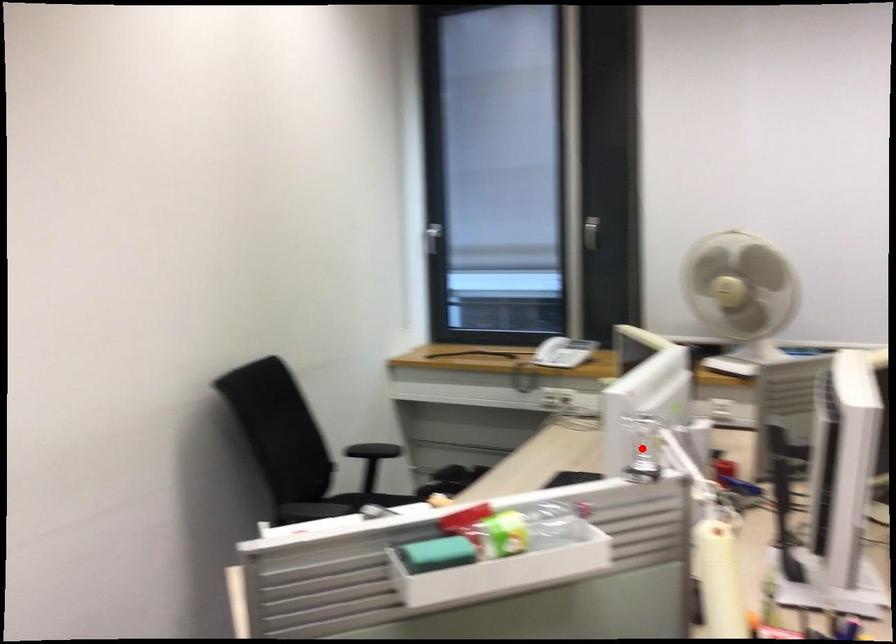
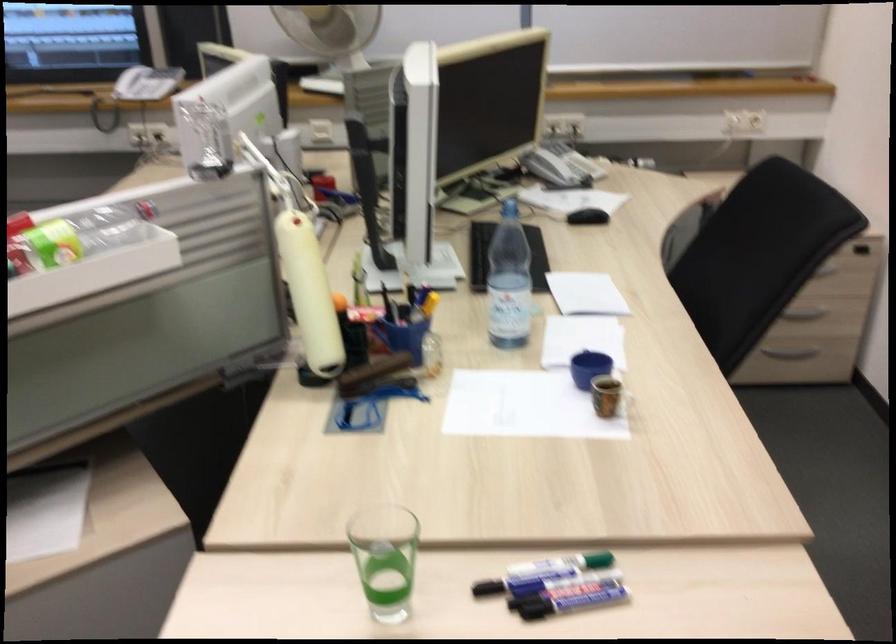
Question: I am providing you with two images of the same scene from different viewpoints. A red point is marked on the first image. Is the red point's position out of view in image 2?

Choices:
 (A) Yes
 (B) No

Answer: (A)